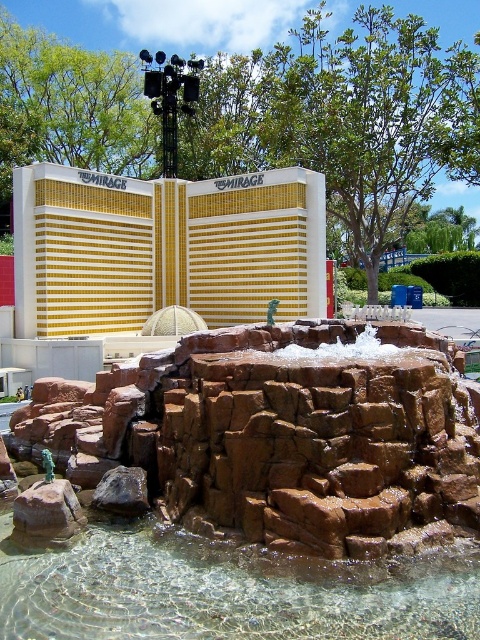
You are an architect designing a new plaza and want to ensure the gold mosaic hotel at center and the clear glass water at center are placed appropriately. Based on the scene, which object is wider?

The gold mosaic hotel at center is wider than the clear glass water at center according to the description.

You are standing in front of the fountain and want to see both the gold mosaic hotel at center and the clear glass water at center. Which one do you need to look up to see?

The gold mosaic hotel at center is above the clear glass water at center, so you need to look up to see the gold mosaic hotel at center.